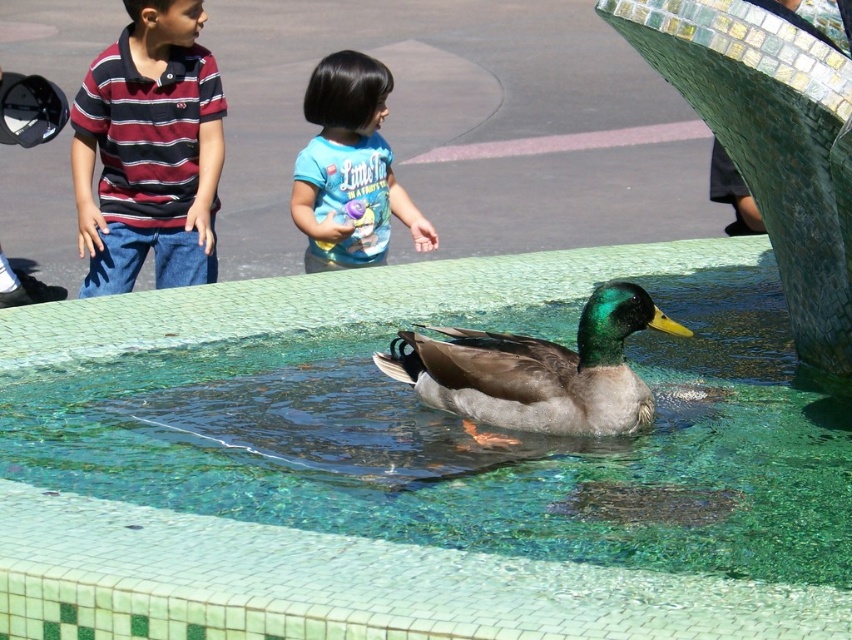
Question: Which of the following is the closest to the observer?

Choices:
 (A) blue cotton shirt at upper center
 (B) striped cotton shirt at upper left

Answer: (B)

Question: Is green mosaic swimming pool at center bigger than striped cotton shirt at upper left?

Choices:
 (A) no
 (B) yes

Answer: (A)

Question: Is green mosaic swimming pool at center positioned at the back of blue cotton shirt at upper center?

Choices:
 (A) yes
 (B) no

Answer: (B)

Question: Which point is farther to the camera?

Choices:
 (A) (353, 97)
 (B) (513, 388)

Answer: (A)

Question: Does striped cotton shirt at upper left lie in front of blue cotton shirt at upper center?

Choices:
 (A) yes
 (B) no

Answer: (A)

Question: Which object appears closest to the camera in this image?

Choices:
 (A) green mosaic swimming pool at center
 (B) blue cotton shirt at upper center

Answer: (A)